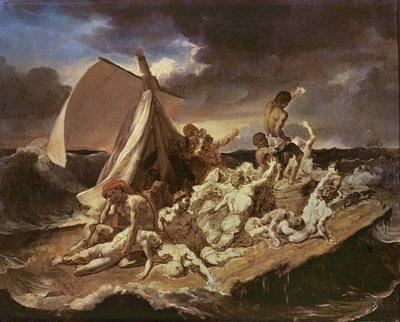
Identify the location of illustrated artwork. (293, 57).